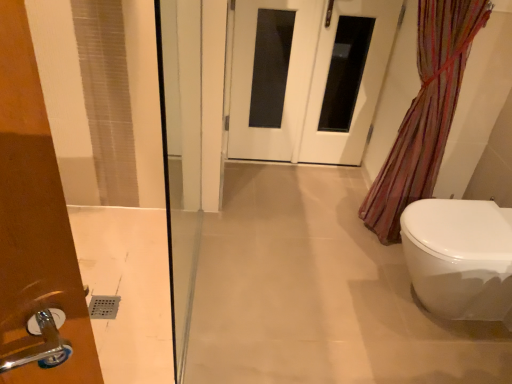
The height and width of the screenshot is (384, 512). Identify the location of free region under translucent striped fabric at right (from a real-world perspective). (358, 234).